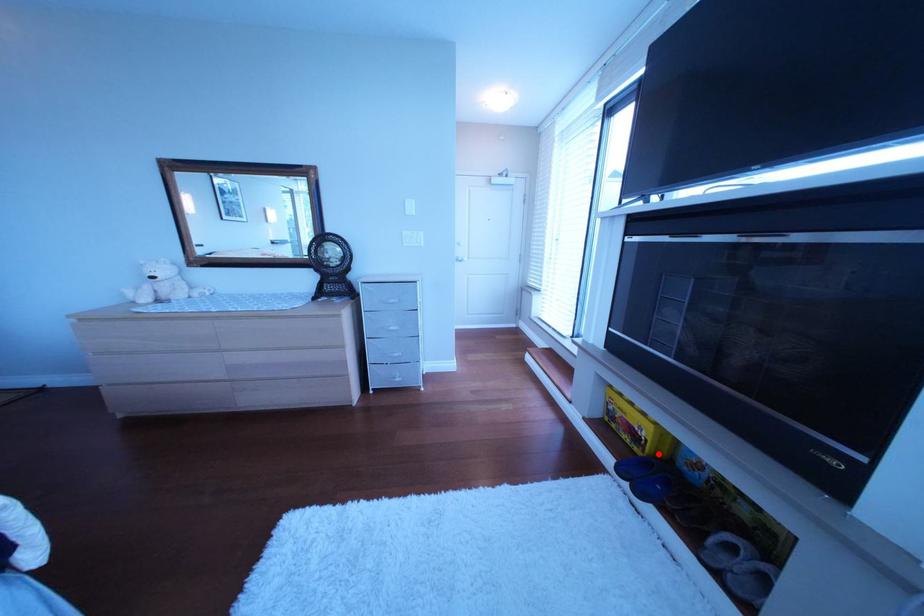
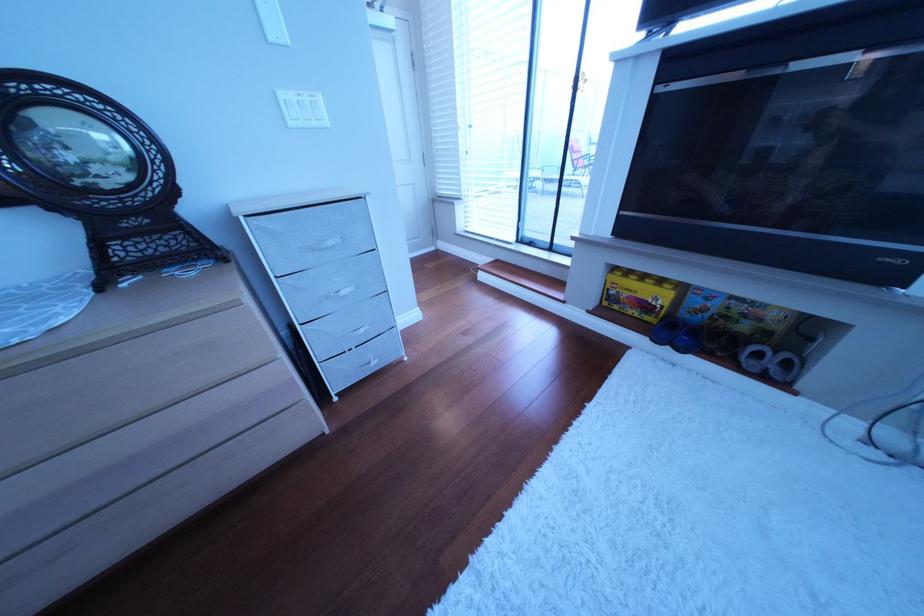
Question: I am providing you with two images of the same scene from different viewpoints. Image1 has a red point marked. In image2, the corresponding 3D location appears at what relative position? Reply with the corresponding letter.

Choices:
 (A) Closer
 (B) Farther

Answer: (A)